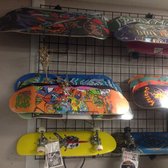
Find the location of `wall`. wall is located at coordinates (6, 129).